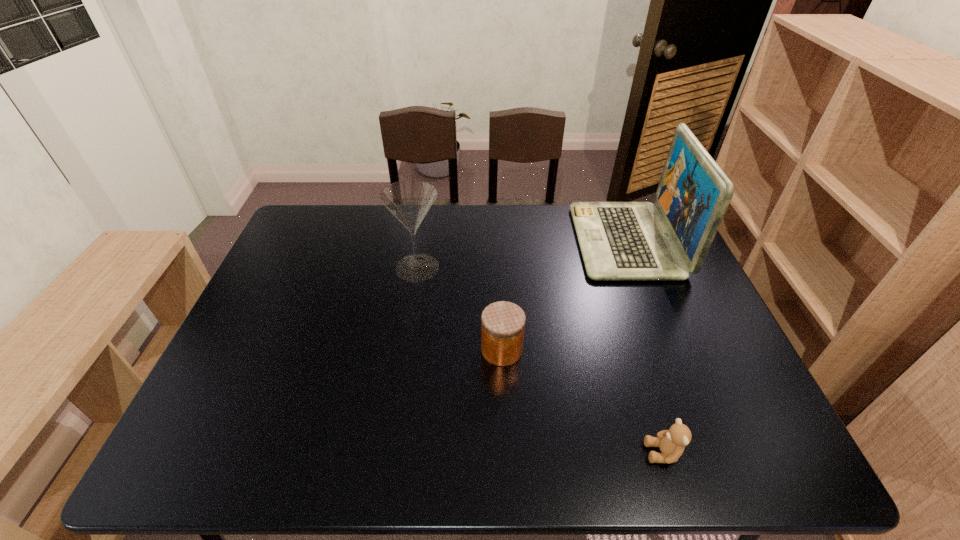
Identify the location of vacant space at the near edge. This screenshot has width=960, height=540. (418, 448).

Identify the location of vacant region at the left edge of the desktop. (271, 329).

Image resolution: width=960 pixels, height=540 pixels. What are the coordinates of `free region at the right edge of the desktop` in the screenshot? It's located at (681, 371).

Locate an element on the screen. empty space that is in between the jar and the shortest object is located at coordinates (583, 401).

Identify the location of free space between the nearest object and the second tallest object. This screenshot has width=960, height=540. (540, 360).

Find the location of a particular element. The width and height of the screenshot is (960, 540). free space between the third tallest object and the shortest object is located at coordinates (583, 401).

You are a GUI agent. You are given a task and a screenshot of the screen. Output one action in this format:
    pyautogui.click(x=<x>, y=<y>)
    Task: Click on the vacant point located between the tallest object and the shortest object
    
    Given the screenshot: What is the action you would take?
    pyautogui.click(x=645, y=347)

The image size is (960, 540). I want to click on vacant area between the second tallest object and the laptop computer, so click(x=522, y=254).

This screenshot has width=960, height=540. Identify the location of empty space between the shortest object and the second nearest object. (583, 401).

Where is `vacant area between the leftmost object and the tallest object`? The height and width of the screenshot is (540, 960). vacant area between the leftmost object and the tallest object is located at coordinates (522, 254).